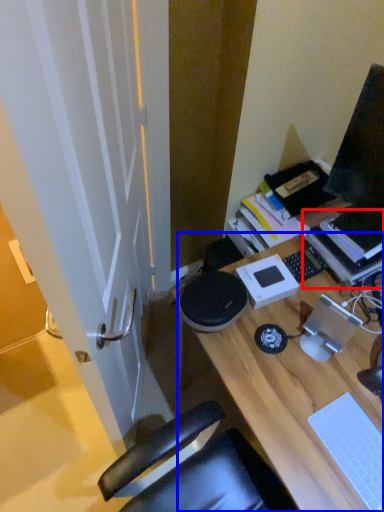
Question: Which point is closer to the camera, book (highlighted by a red box) or desk (highlighted by a blue box)?

Choices:
 (A) book
 (B) desk

Answer: (B)